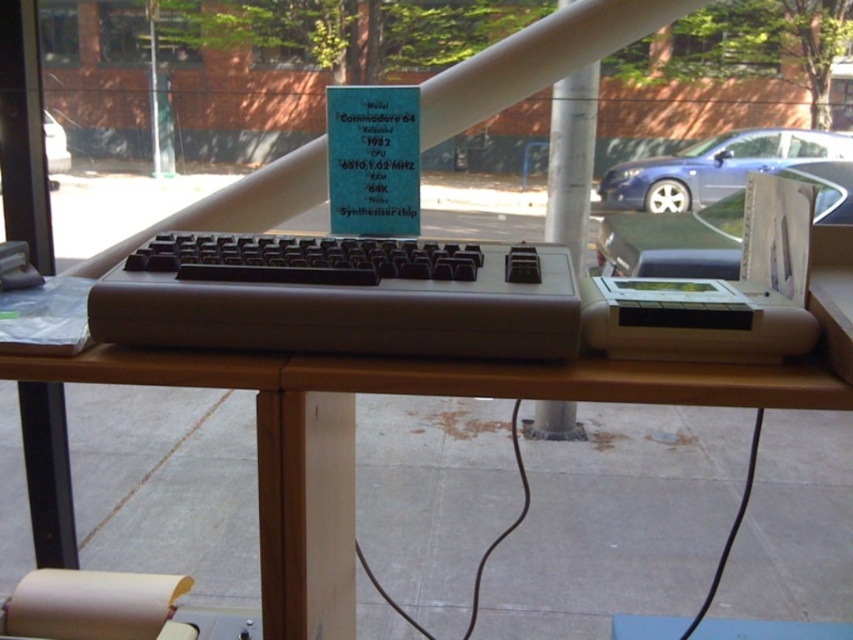
Question: Is matte black keyboard at center behind metallic blue car at left?

Choices:
 (A) yes
 (B) no

Answer: (B)

Question: Which object is positioned closest to the white plastic pillar at center?

Choices:
 (A) matte black keyboard at center
 (B) metallic blue car at left
 (C) metallic blue sedan at center

Answer: (A)

Question: Among these objects, which one is farthest from the camera?

Choices:
 (A) brown wood table at center
 (B) white plastic pillar at center
 (C) matte black keyboard at center

Answer: (B)

Question: From the image, what is the correct spatial relationship of brown wood table at center in relation to matte black keyboard at center?

Choices:
 (A) above
 (B) below

Answer: (B)

Question: Which point is closer to the camera taking this photo?

Choices:
 (A) (791, 140)
 (B) (548, 179)
 (C) (643, 362)

Answer: (C)

Question: Can you confirm if metallic blue sedan at center is positioned below white plastic pillar at center?

Choices:
 (A) yes
 (B) no

Answer: (B)